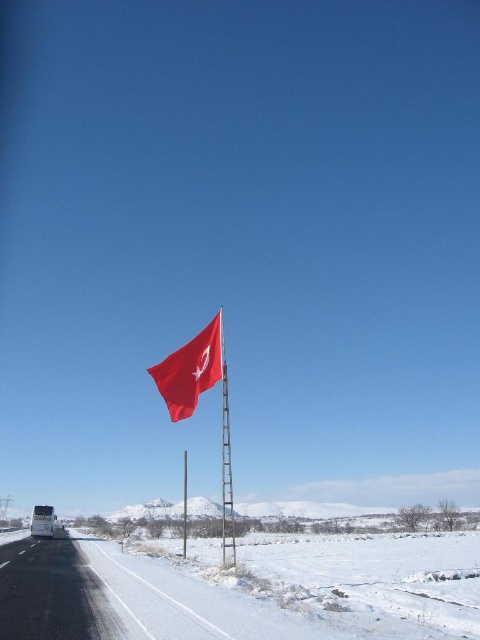
Question: Which object is closer to the camera taking this photo?

Choices:
 (A) black asphalt highway at lower left
 (B) matte red flag at center

Answer: (A)

Question: Can you confirm if black asphalt highway at lower left is wider than matte red flag at center?

Choices:
 (A) no
 (B) yes

Answer: (B)

Question: Is the position of matte red flag at center less distant than that of metallic silver flag pole at center?

Choices:
 (A) no
 (B) yes

Answer: (A)

Question: Which point appears closest to the camera in this image?

Choices:
 (A) (45, 634)
 (B) (227, 449)

Answer: (A)

Question: Is black asphalt highway at lower left further to camera compared to matte red flag at center?

Choices:
 (A) no
 (B) yes

Answer: (A)

Question: Which point is farther to the camera?

Choices:
 (A) black asphalt highway at lower left
 (B) metallic silver flag pole at center

Answer: (B)